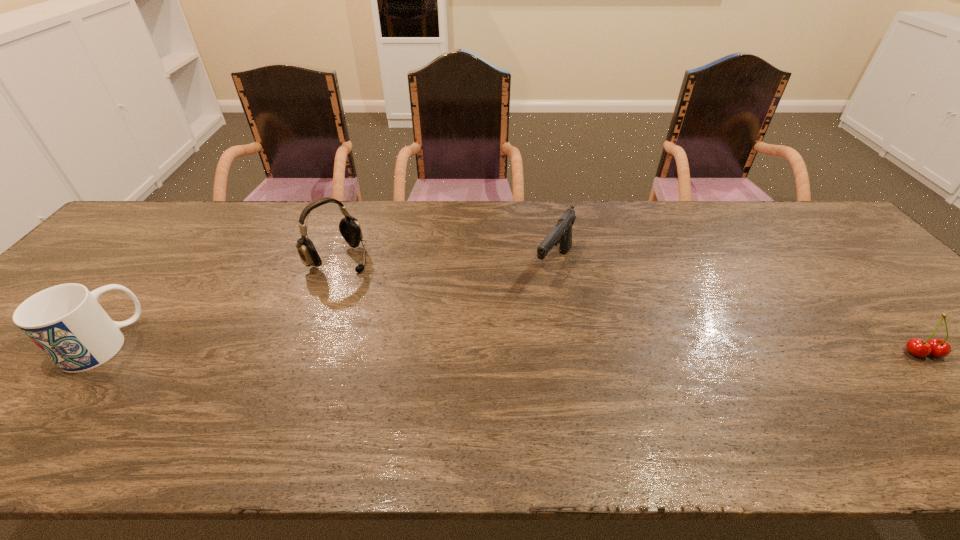
Identify the location of vacant space on the desktop that is between the mug and the shortest object and is positioned with the microphone on the side of the tallest object. (444, 348).

I want to click on vacant spot on the desktop that is between the mug and the rightmost object and is positioned at the muzzle of the third object from left to right, so [x=583, y=349].